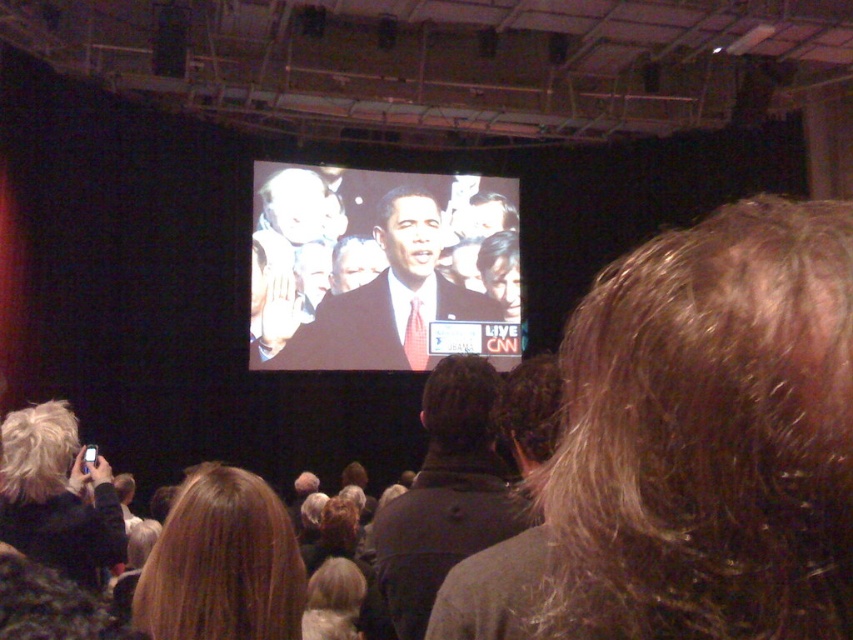
You are attending a live event and notice two items on the stage. One is the matte black suit at center and the other is the dark gray jacket at center. Which one is positioned higher up?

The matte black suit at center is located above the dark gray jacket at center, so it is positioned higher up.

You are a photographer at the event and need to capture a clear shot of both the matte black suit at center and the blonde hair at lower center. Which object should you focus on first to ensure it appears larger in your photo?

The matte black suit at center is taller than the blonde hair at lower center, so you should focus on the matte black suit at center first to ensure it appears larger in your photo.

You are a camera operator at the live event and need to focus on both the point at (x=432, y=188) and the point at (x=273, y=528). Which point should you adjust your camera focus to first to ensure both are in clear view?

You should first focus on the point at (x=432, y=188) because it is closer to the viewer than the point at (x=273, y=528). This ensures that when adjusting focus, both points can be brought into clarity by fine tuning the focus from the closer point outward.